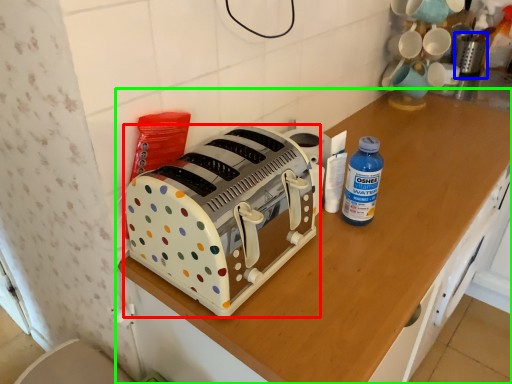
Question: Which is farther away from toaster (highlighted by a red box)? appliance (highlighted by a blue box) or cabinetry (highlighted by a green box)?

Choices:
 (A) appliance
 (B) cabinetry

Answer: (A)